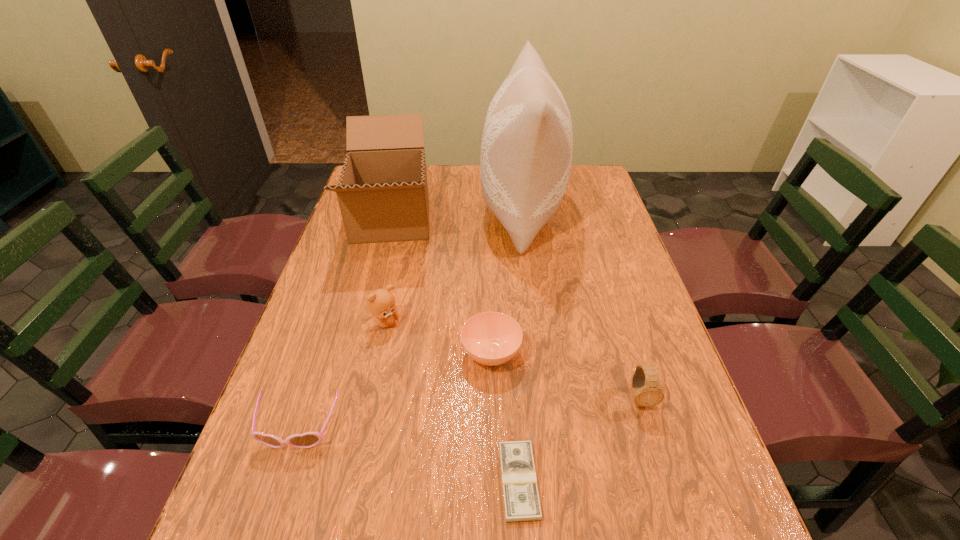
At what (x,y) coordinates should I click in order to perform the action: click on cushion. Please return your answer as a coordinate pair (x, y). Looking at the image, I should click on (527, 144).

You are a GUI agent. You are given a task and a screenshot of the screen. Output one action in this format:
    pyautogui.click(x=<x>, y=<y>)
    Task: Click on the box
    Image resolution: width=960 pixels, height=540 pixels.
    Given the screenshot: What is the action you would take?
    pyautogui.click(x=382, y=192)

Where is `teddy bear`? The width and height of the screenshot is (960, 540). teddy bear is located at coordinates (381, 303).

Where is `the rightmost object`? This screenshot has height=540, width=960. the rightmost object is located at coordinates (648, 393).

Where is `soup bowl`? soup bowl is located at coordinates (490, 338).

This screenshot has width=960, height=540. I want to click on sunglasses, so click(309, 439).

Where is `dollar`? This screenshot has height=540, width=960. dollar is located at coordinates (521, 499).

You are a GUI agent. You are given a task and a screenshot of the screen. Output one action in this format:
    pyautogui.click(x=<x>, y=<y>)
    Task: Click on the vacant space positioned on the front side of the tallest object
    
    Given the screenshot: What is the action you would take?
    pyautogui.click(x=401, y=211)

Identify the location of vacant point located 0.330m on the front side of the tallest object. Image resolution: width=960 pixels, height=540 pixels. pos(384,211).

This screenshot has width=960, height=540. Identify the location of vacant space located on the front side of the tallest object. (396, 211).